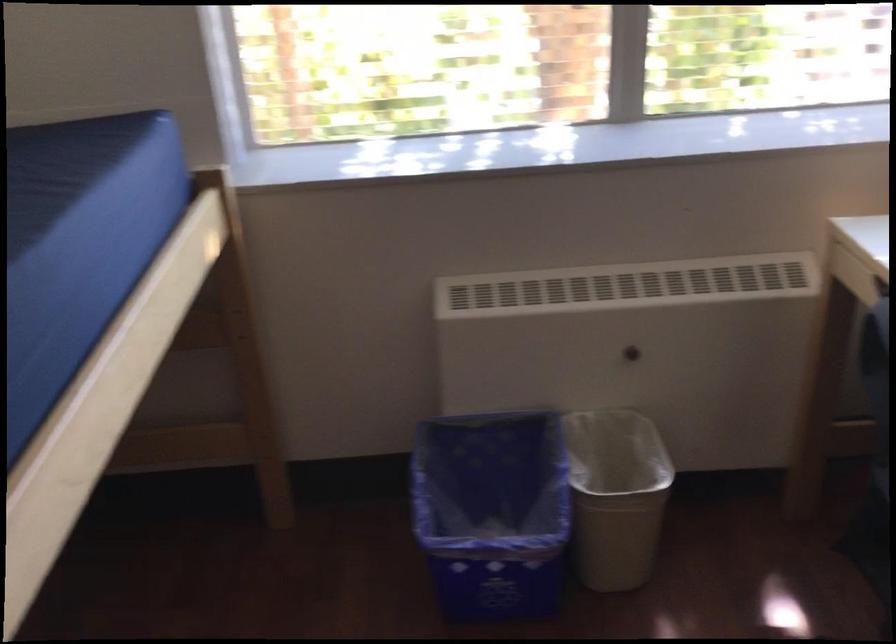
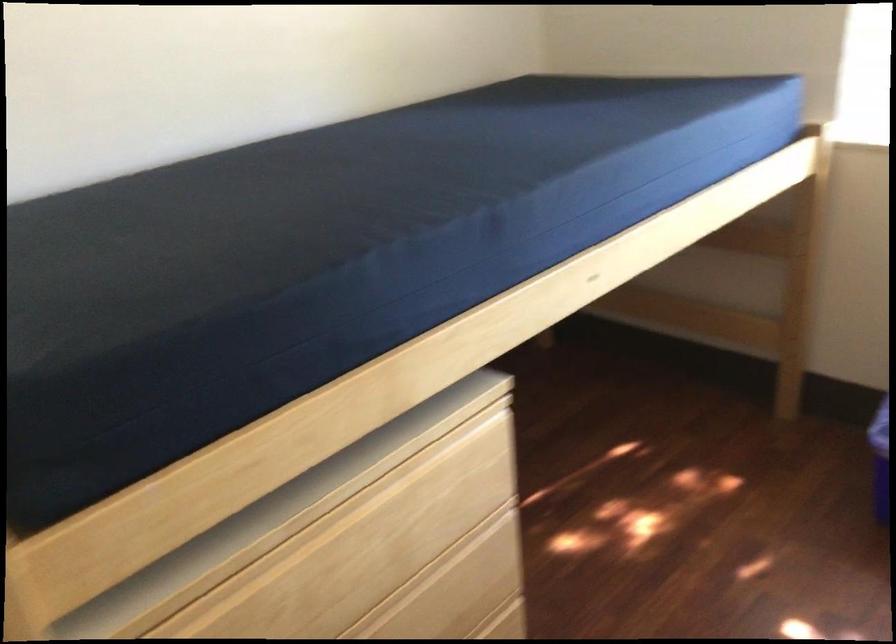
Locate, in the second image, the point that corresponds to point 261,365 in the first image.

(803, 275)